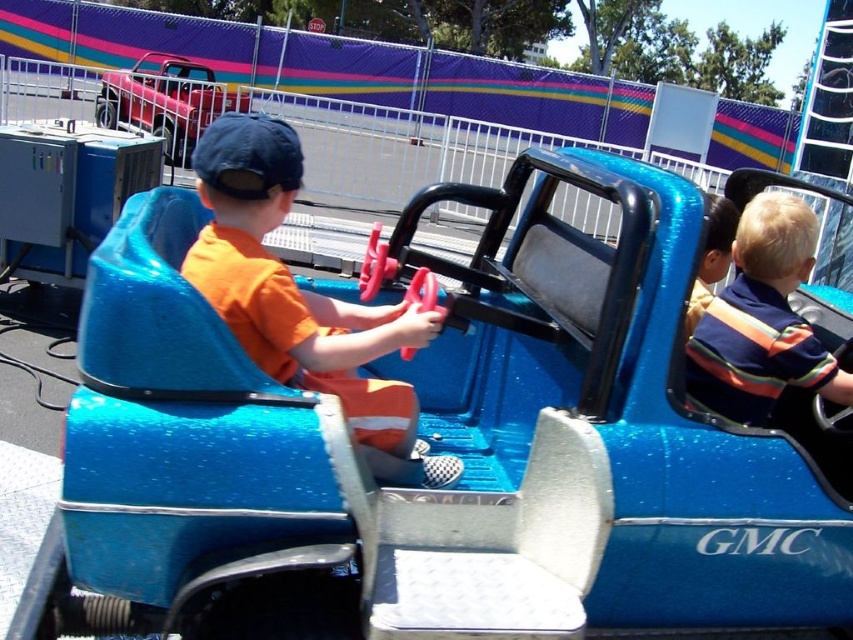
Is metallic pink car at upper left bigger than striped shirt at center?

Correct, metallic pink car at upper left is larger in size than striped shirt at center.

Between metallic pink car at upper left and striped shirt at center, which one is positioned higher?

metallic pink car at upper left is above.

Is point (144, 106) less distant than point (724, 232)?

That is False.

This screenshot has height=640, width=853. Find the location of `metallic pink car at upper left`. metallic pink car at upper left is located at coordinates (166, 100).

In the scene shown: Can you confirm if striped cotton shirt at center is shorter than metallic pink car at upper left?

Indeed, striped cotton shirt at center has a lesser height compared to metallic pink car at upper left.

Is point (844, 378) less distant than point (119, 93)?

Yes, it is in front of point (119, 93).

Locate an element on the screen. striped cotton shirt at center is located at coordinates (761, 321).

Locate an element on the screen. This screenshot has width=853, height=640. striped cotton shirt at center is located at coordinates (761, 321).

Which of these two, striped cotton shirt at center or striped shirt at center, stands shorter?

With less height is striped shirt at center.

Is point (691, 378) farther from viewer compared to point (714, 198)?

That is False.

Find the location of `striped cotton shirt at center`. striped cotton shirt at center is located at coordinates (761, 321).